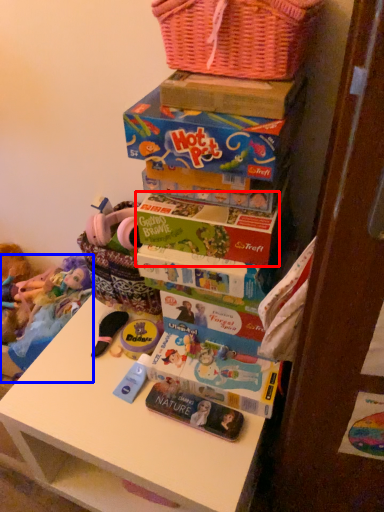
Question: Which object is closer to the camera taking this photo, book (highlighted by a red box) or toy (highlighted by a blue box)?

Choices:
 (A) book
 (B) toy

Answer: (A)